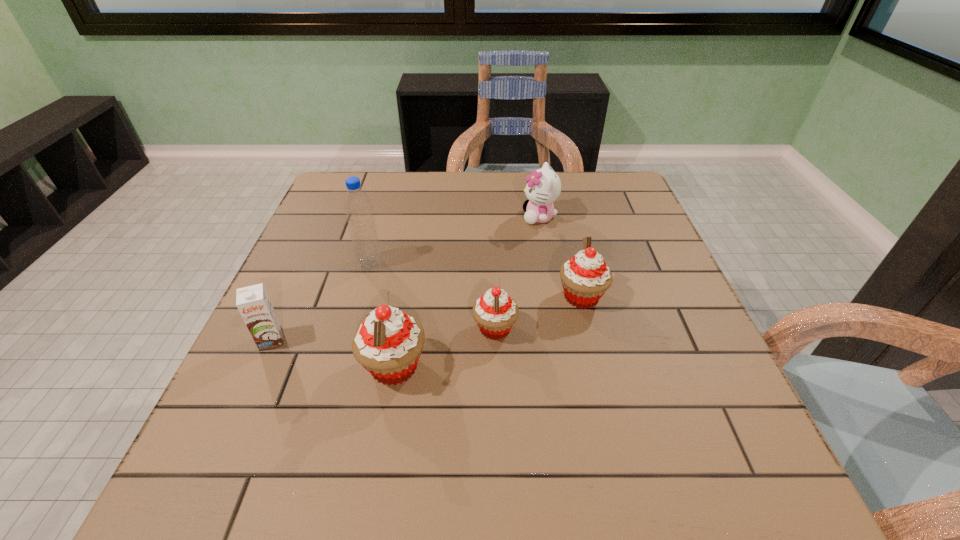
Locate an element on the screen. This screenshot has height=540, width=960. free region that satisfies the following two spatial constraints: 1. on the front-facing side of the kitten; 2. on the front side of the fifth object from right to left is located at coordinates (547, 263).

Locate an element on the screen. The image size is (960, 540). vacant region that satisfies the following two spatial constraints: 1. on the front-facing side of the kitten; 2. on the front side of the second farthest object is located at coordinates (547, 263).

Identify the location of free location that satisfies the following two spatial constraints: 1. on the front-facing side of the farthest object; 2. on the right side of the rightmost cupcake. (553, 296).